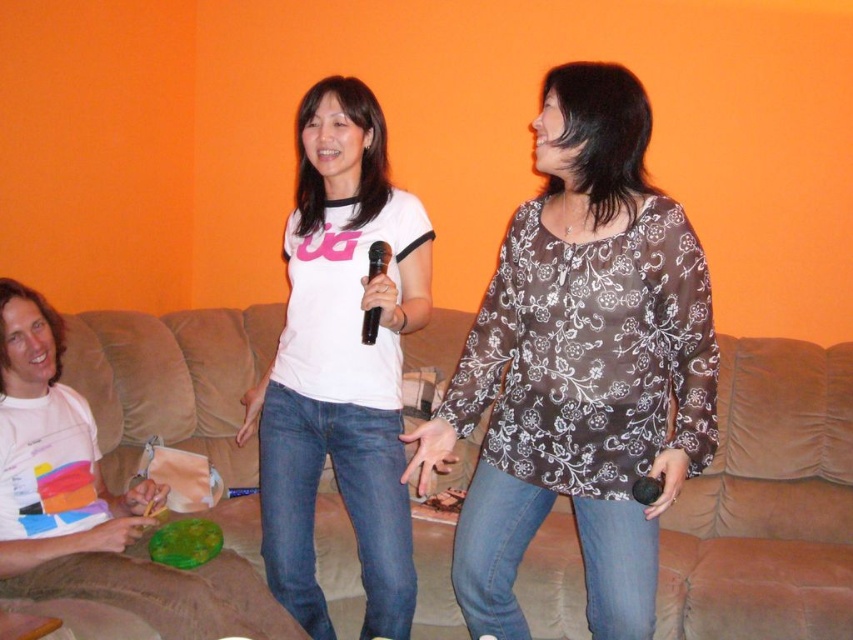
Is the position of brown sheer blouse at center less distant than that of white matte t-shirt at center?

Yes, brown sheer blouse at center is closer to the viewer.

Who is more distant from viewer, (486, 547) or (373, 387)?

Positioned behind is point (373, 387).

You are a GUI agent. You are given a task and a screenshot of the screen. Output one action in this format:
    pyautogui.click(x=<x>, y=<y>)
    Task: Click on the brown sheer blouse at center
    
    Given the screenshot: What is the action you would take?
    pyautogui.click(x=581, y=365)

Does brown fabric couch at center have a lesser height compared to white matte t-shirt at center?

Indeed, brown fabric couch at center has a lesser height compared to white matte t-shirt at center.

Who is positioned more to the left, brown fabric couch at center or white matte t-shirt at center?

white matte t-shirt at center is more to the left.

At what (x,y) coordinates should I click in order to perform the action: click on brown fabric couch at center. Please return your answer as a coordinate pair (x, y). Looking at the image, I should click on (767, 502).

Is white matte t-shirt at center thinner than black plastic microphone at center?

No.

Is white matte t-shirt at center closer to the viewer compared to black plastic microphone at center?

No, white matte t-shirt at center is further to the viewer.

Which is in front, point (331, 198) or point (363, 320)?

Point (363, 320) is in front.

Where is `white matte t-shirt at center`? This screenshot has width=853, height=640. white matte t-shirt at center is located at coordinates (341, 364).